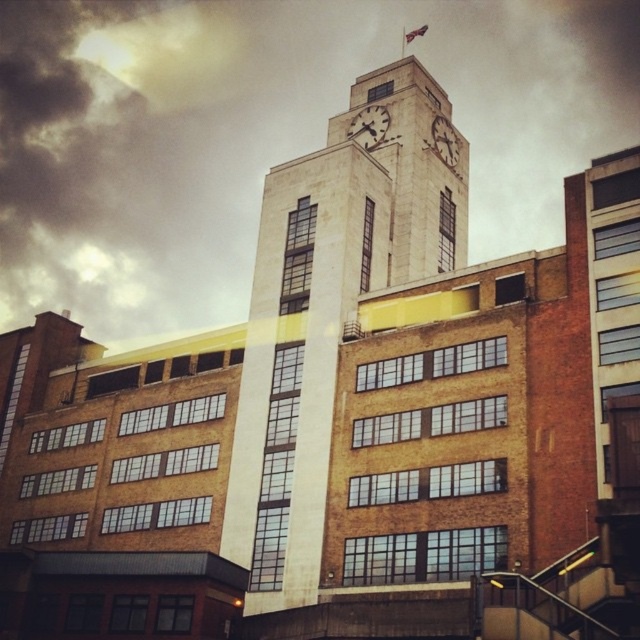
You are standing in front of the clock tower and want to determine the relative positions of two points marked on the tower. Which point is closer to you, point (472,61) or point (316,556)?

Point (472,61) is further to the viewer than point (316,556), so point (316,556) is closer to you.

You are standing in front of the clock tower and looking up. There is a point at coordinates (266, 132) in your field of view. What is located at that point?

The point at coordinates (266, 132) corresponds to the cloudy sky at upper center.